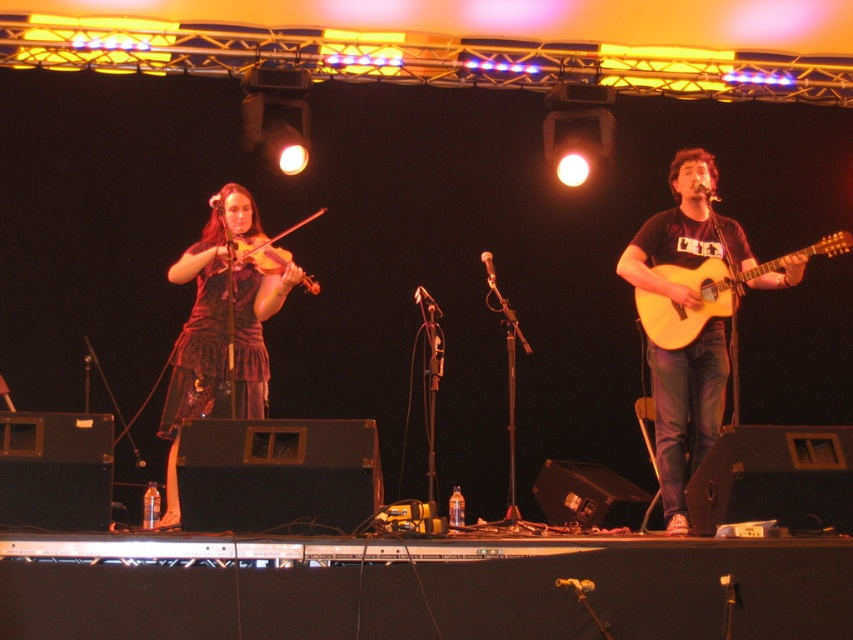
Between shiny purple dress at left and metallic silver microphone at upper right, which one is positioned lower?

shiny purple dress at left is lower down.

Who is more forward, (193, 310) or (708, 200)?

Point (708, 200)

Where is `shiny purple dress at left`? shiny purple dress at left is located at coordinates (219, 332).

Between wooden violin at center and metallic silver microphone at upper center, which one has more height?

Standing taller between the two is wooden violin at center.

Between wooden violin at center and metallic silver microphone at upper center, which one appears on the left side from the viewer's perspective?

Positioned to the left is metallic silver microphone at upper center.

Find the location of a particular element. The image size is (853, 640). wooden violin at center is located at coordinates (264, 248).

Can you confirm if light brown acoustic guitar at right is thinner than metallic silver microphone at upper right?

No, light brown acoustic guitar at right is not thinner than metallic silver microphone at upper right.

Is point (839, 252) behind point (701, 182)?

No, (839, 252) is closer to viewer.

Is point (701, 291) positioned after point (705, 195)?

That is False.

Identify the location of light brown acoustic guitar at right. This screenshot has width=853, height=640. (699, 296).